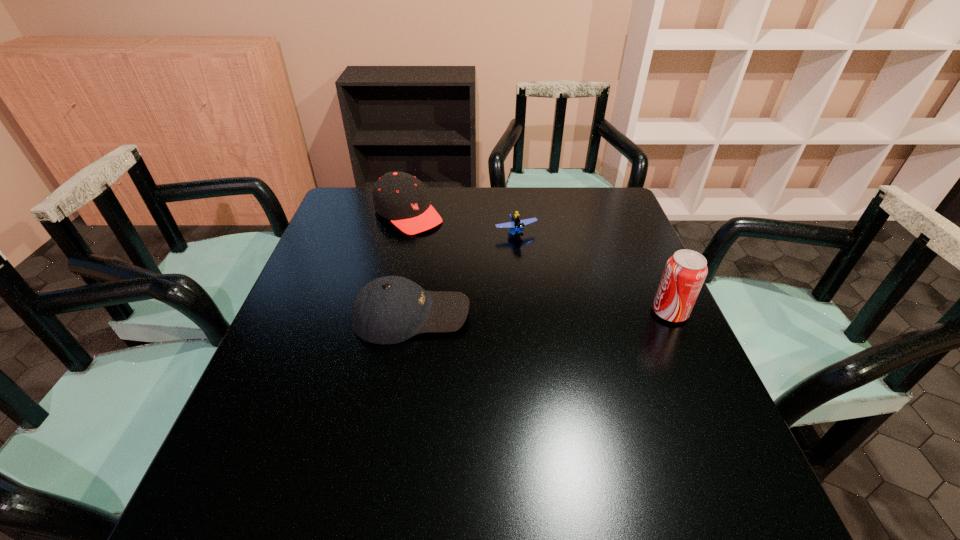
This screenshot has height=540, width=960. Identify the location of free space between the baseball cap and the soda can. (540, 314).

The width and height of the screenshot is (960, 540). In order to click on vacant space that's between the second shortest object and the third shortest object in this screenshot , I will do `click(410, 264)`.

Identify the location of vacant area that lies between the shortest object and the baseball cap. This screenshot has height=540, width=960. (464, 274).

The width and height of the screenshot is (960, 540). I want to click on unoccupied position between the soda can and the cap, so click(539, 263).

In order to click on unoccupied position between the shortest object and the rightmost object in this screenshot , I will do `click(593, 273)`.

This screenshot has height=540, width=960. Find the location of `free space between the Lego and the rightmost object`. free space between the Lego and the rightmost object is located at coordinates [x=593, y=273].

You are a GUI agent. You are given a task and a screenshot of the screen. Output one action in this format:
    pyautogui.click(x=<x>, y=<y>)
    Task: Click on the vacant area that lies between the cap and the tallest object
    This screenshot has width=960, height=540.
    Given the screenshot: What is the action you would take?
    pyautogui.click(x=539, y=263)

Identify the location of vacant area that lies between the rightmost object and the second object from right to left. The width and height of the screenshot is (960, 540). (593, 273).

The image size is (960, 540). I want to click on object that is the closest to the third object from left to right, so click(x=400, y=197).

Select which object is the second closest to the Lego. Please provide its 2D coordinates. Your answer should be formatted as a tuple, i.e. [(x, y)], where the tuple contains the x and y coordinates of a point satisfying the conditions above.

[(389, 310)]